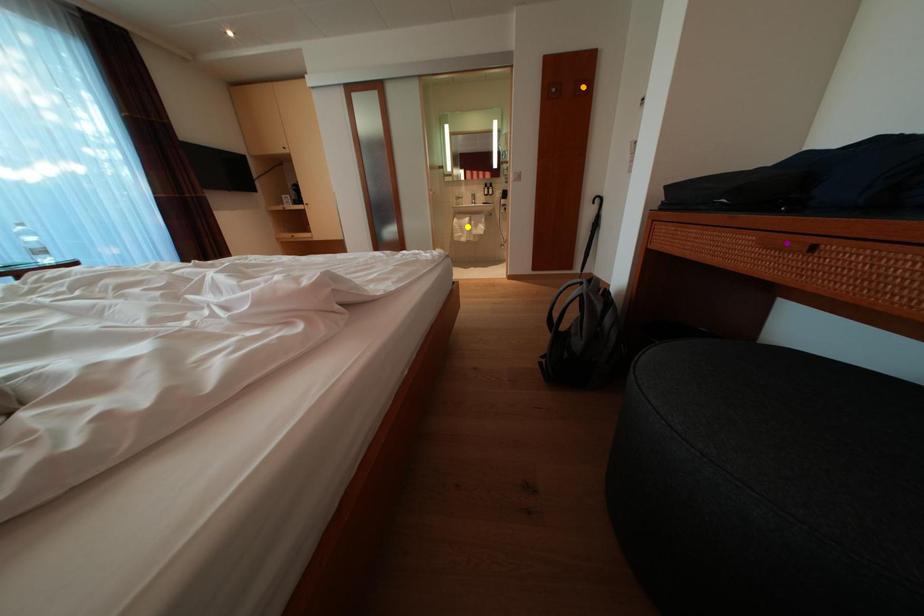
Order these from farthest to nearest:
- orange point
- purple point
- yellow point

yellow point < orange point < purple point